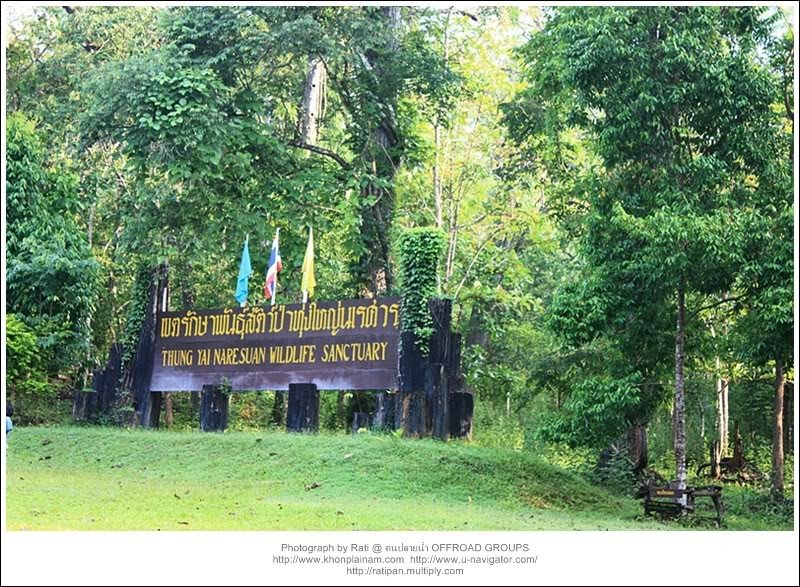
At what (x,y) coordinates should I click in order to perform the action: click on wooden beams. Please return your answer as a coordinate pair (x, y). Looking at the image, I should click on (145, 401), (210, 406), (294, 411), (414, 410).